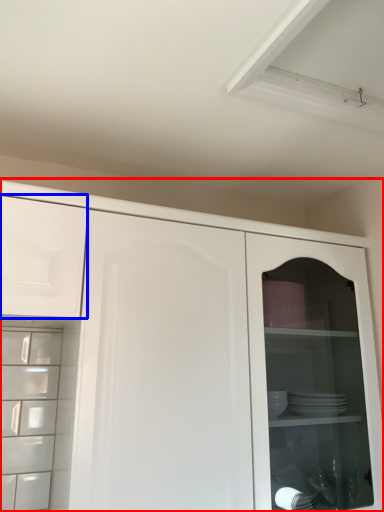
Question: Which object appears farthest to the camera in this image, cupboard (highlighted by a red box) or drawer (highlighted by a blue box)?

Choices:
 (A) cupboard
 (B) drawer

Answer: (B)